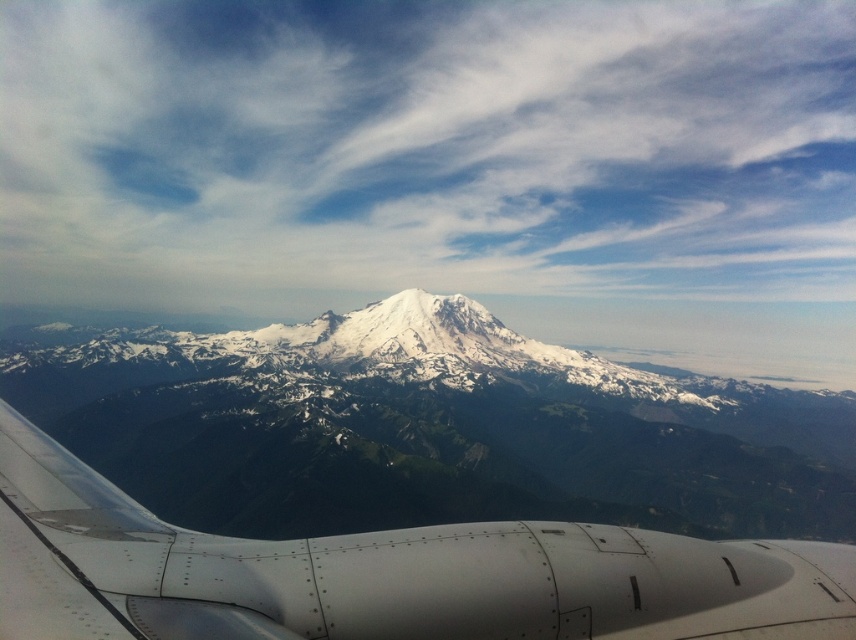
You are a pilot flying at 30,000 feet and notice a point in the sky ahead of you. Based on the coordinates provided, can you identify what is located at point (425, 148)?

The point (425, 148) indicates a white fluffy cloud at upper center.